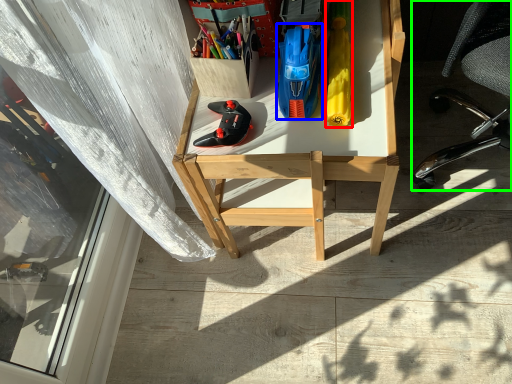
Question: Based on their relative distances, which object is farther from stationery (highlighted by a red box)? Choose from stationery (highlighted by a blue box) and chair (highlighted by a green box).

Choices:
 (A) stationery
 (B) chair

Answer: (B)